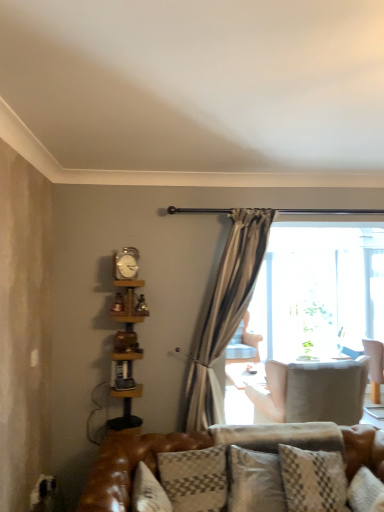
Question: In terms of height, does clear glass screen door at center look taller or shorter compared to plush gray pillow at center, the first pillow when ordered from right to left?

Choices:
 (A) tall
 (B) short

Answer: (A)

Question: Visually, is clear glass screen door at center positioned to the left or to the right of plush gray pillow at center, the first pillow when ordered from right to left?

Choices:
 (A) left
 (B) right

Answer: (B)

Question: Based on their relative distances, which object is nearer to the plush gray pillow at center, the first pillow when ordered from back to front?

Choices:
 (A) light beige fabric chair at center, which is the 2th chair from left to right
 (B) metallic silver clock at upper center
 (C) wooden bookshelf at left
 (D) clear glass screen door at center
 (E) light beige fabric chair at right, positioned as the first chair in right-to-left order

Answer: (A)

Question: Estimate the real-world distances between objects in this image. Which object is closer to the plaid fabric pillow at center, the 2th pillow in the back-to-front sequence?

Choices:
 (A) clear glass screen door at center
 (B) plush gray pillow at center, the first pillow when ordered from right to left
 (C) velvet beige chair at center, the 1th chair viewed from the back
 (D) light beige fabric chair at center, the 3th chair positioned from the back
 (E) metallic silver clock at upper center

Answer: (B)